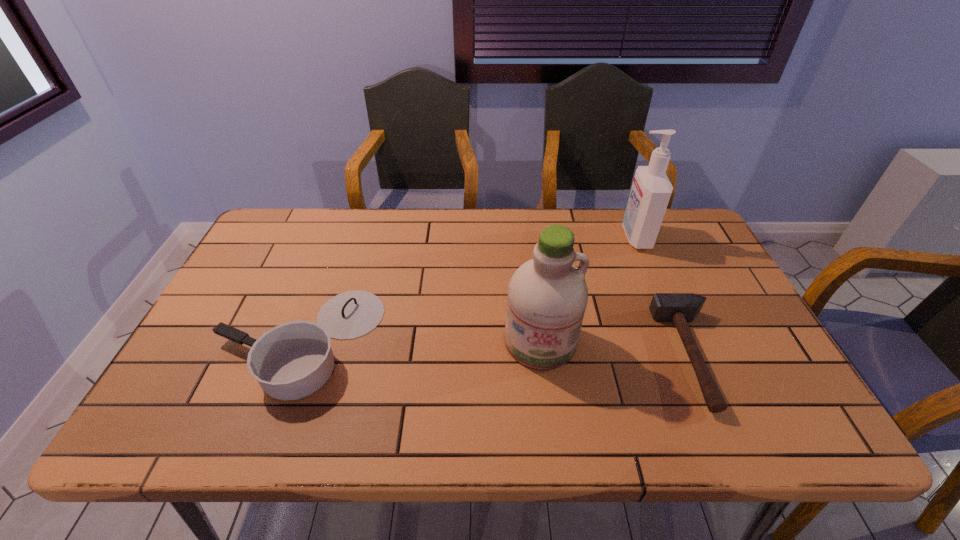
Identify the location of the right cleansing agent. Image resolution: width=960 pixels, height=540 pixels. (651, 190).

At what (x,y) coordinates should I click in order to perform the action: click on the farther cleansing agent. Please return your answer as a coordinate pair (x, y). The width and height of the screenshot is (960, 540). Looking at the image, I should click on (651, 190).

The width and height of the screenshot is (960, 540). What are the coordinates of `the left cleansing agent` in the screenshot? It's located at (547, 296).

Locate an element on the screen. The width and height of the screenshot is (960, 540). the nearer cleansing agent is located at coordinates (547, 296).

At what (x,y) coordinates should I click in order to perform the action: click on the second shortest object. Please return your answer as a coordinate pair (x, y). Looking at the image, I should click on (293, 360).

Identify the location of saucepan. The width and height of the screenshot is (960, 540). 293,360.

This screenshot has height=540, width=960. Identify the location of hammer. (680, 308).

The width and height of the screenshot is (960, 540). I want to click on free space located on the front label of the right cleansing agent, so click(x=562, y=237).

At what (x,y) coordinates should I click in order to perform the action: click on vacant space located 0.260m on the front label of the right cleansing agent. Please return your answer as a coordinate pair (x, y). The height and width of the screenshot is (540, 960). Looking at the image, I should click on (540, 237).

Find the location of `blank area located 0.110m on the front label of the right cleansing agent`. blank area located 0.110m on the front label of the right cleansing agent is located at coordinates (587, 237).